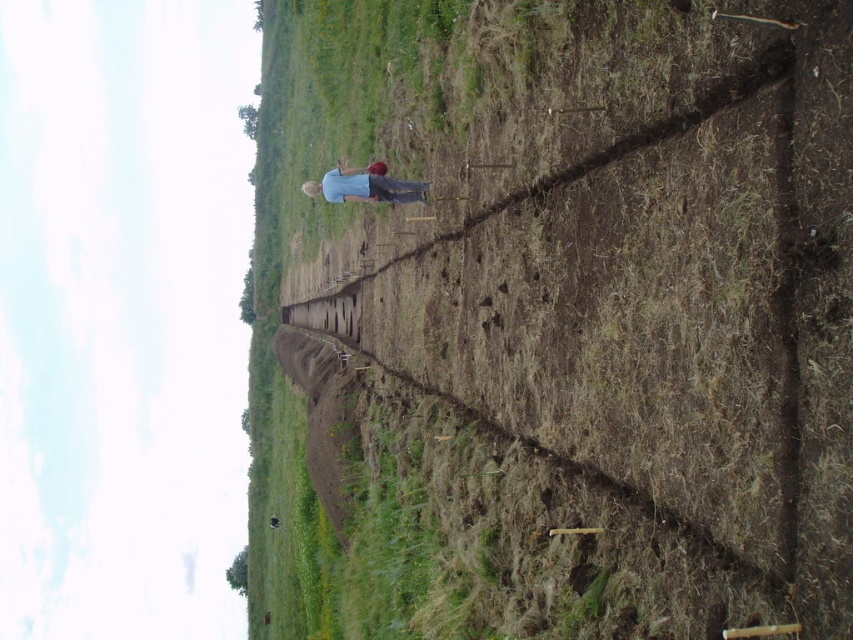
Question: Which point is farther to the camera?

Choices:
 (A) blue cotton shirt at center
 (B) brown soil at center

Answer: (A)

Question: Is brown soil at center positioned in front of blue cotton shirt at center?

Choices:
 (A) no
 (B) yes

Answer: (B)

Question: Among these objects, which one is nearest to the camera?

Choices:
 (A) blue cotton shirt at center
 (B) brown soil at center

Answer: (B)

Question: Is brown soil at center positioned before blue cotton shirt at center?

Choices:
 (A) yes
 (B) no

Answer: (A)

Question: Which point is closer to the camera taking this photo?

Choices:
 (A) (252, 550)
 (B) (422, 198)

Answer: (B)

Question: Does brown soil at center appear under blue cotton shirt at center?

Choices:
 (A) no
 (B) yes

Answer: (B)